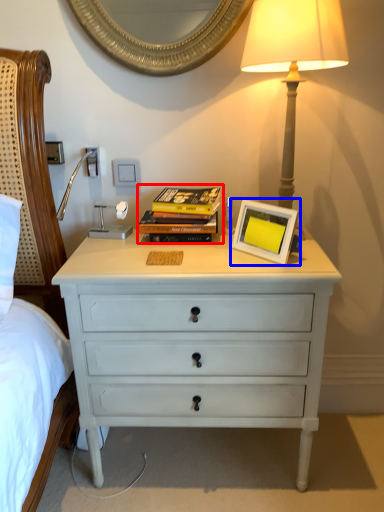
Question: Which of the following is the closest to the observer, magazine (highlighted by a red box) or picture frame (highlighted by a blue box)?

Choices:
 (A) magazine
 (B) picture frame

Answer: (B)